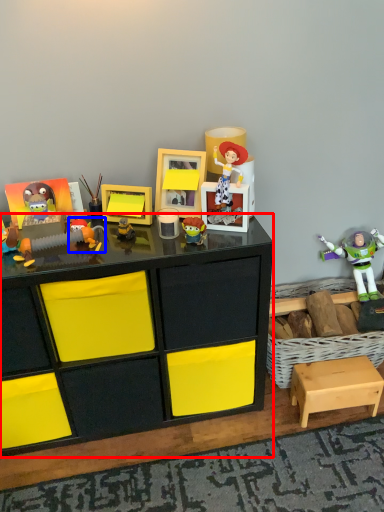
Question: Among these objects, which one is nearest to the camera, desk (highlighted by a red box) or toy (highlighted by a blue box)?

Choices:
 (A) desk
 (B) toy

Answer: (A)